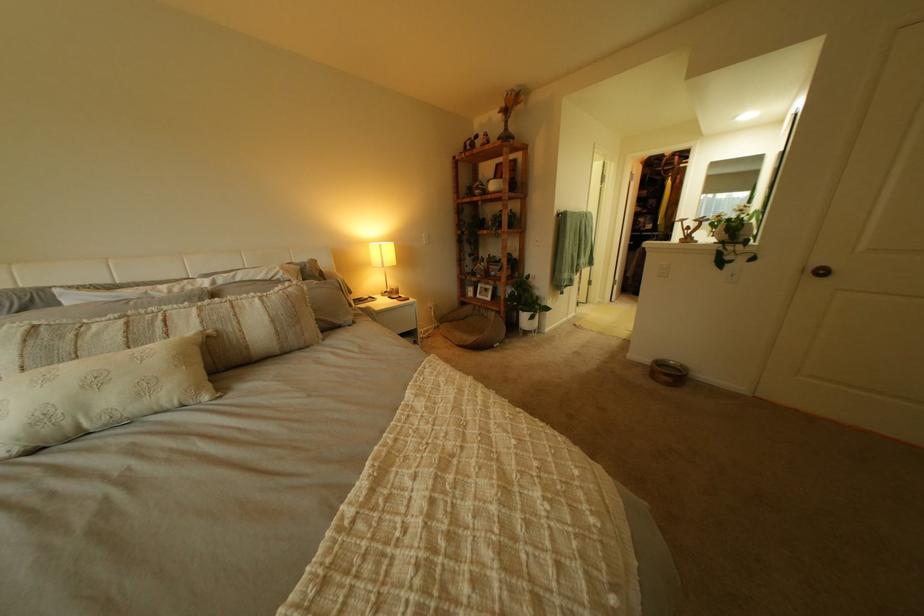
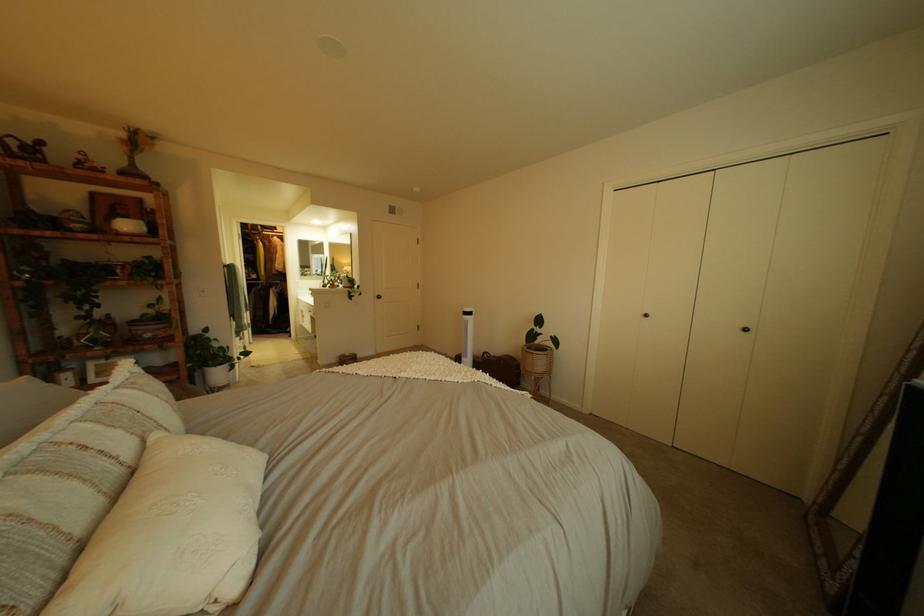
Where in the second image is the point corresponding to point 514,310 from the first image?

(189, 379)